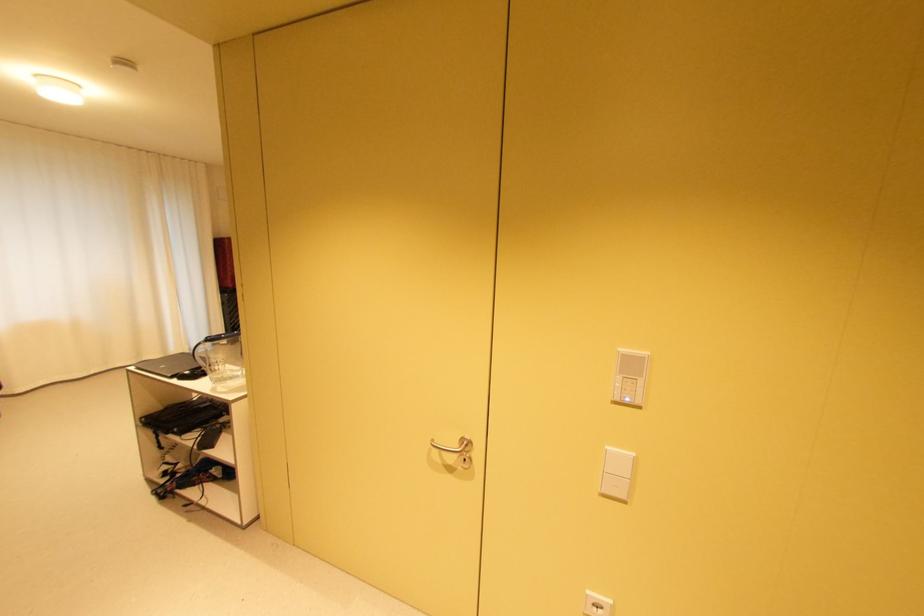
Identify the location of silver door handle. (457, 450).